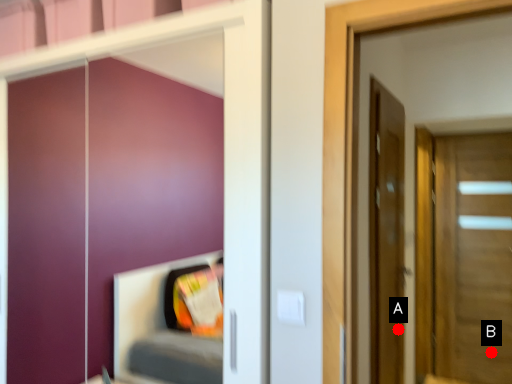
Question: Two points are circled on the image, labeled by A and B beside each circle. Which point is farther to the camera?

Choices:
 (A) A is further
 (B) B is further

Answer: (B)